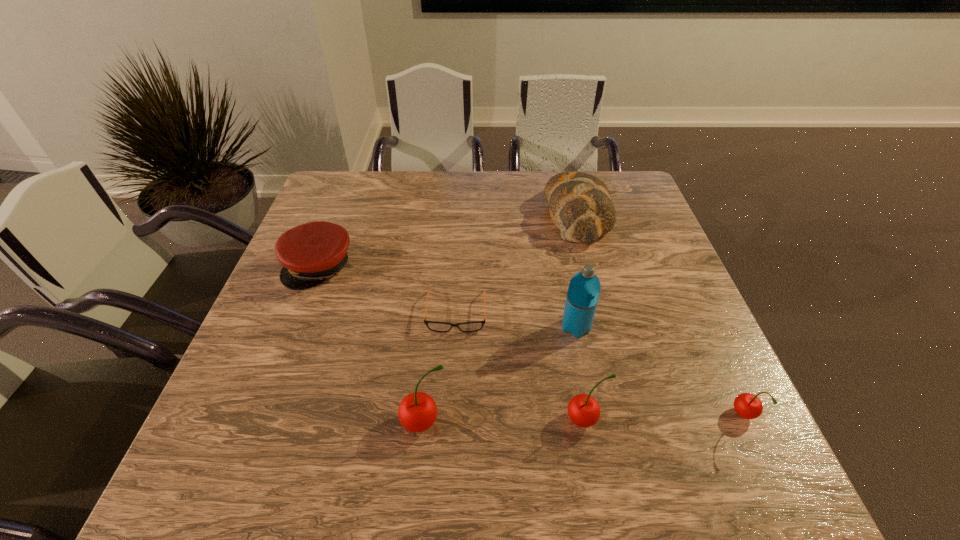
The image size is (960, 540). I want to click on object at the far right corner, so click(580, 204).

Identify the location of object present at the near right corner. (748, 406).

In the image, there is a desktop. Identify the location of vacant space at the far edge. The image size is (960, 540). (490, 195).

You are a GUI agent. You are given a task and a screenshot of the screen. Output one action in this format:
    pyautogui.click(x=<x>, y=<y>)
    Task: Click on the vacant space at the near edge
    
    Given the screenshot: What is the action you would take?
    pyautogui.click(x=517, y=428)

Locate an element on the screen. vacant space at the left edge of the desktop is located at coordinates (250, 367).

Locate an element on the screen. This screenshot has width=960, height=540. free space at the right edge of the desktop is located at coordinates (715, 361).

At what (x,y) coordinates should I click in order to perform the action: click on free space at the near left corner. Please return your answer as a coordinate pair (x, y). Looking at the image, I should click on (221, 428).

Where is `unoccupied position between the cap and the bread`? Image resolution: width=960 pixels, height=540 pixels. unoccupied position between the cap and the bread is located at coordinates (448, 240).

The height and width of the screenshot is (540, 960). Find the location of `vacant area between the cap and the second tallest object`. vacant area between the cap and the second tallest object is located at coordinates (372, 345).

Locate an element on the screen. Image resolution: width=960 pixels, height=540 pixels. empty space between the shortest cherry and the cap is located at coordinates (532, 341).